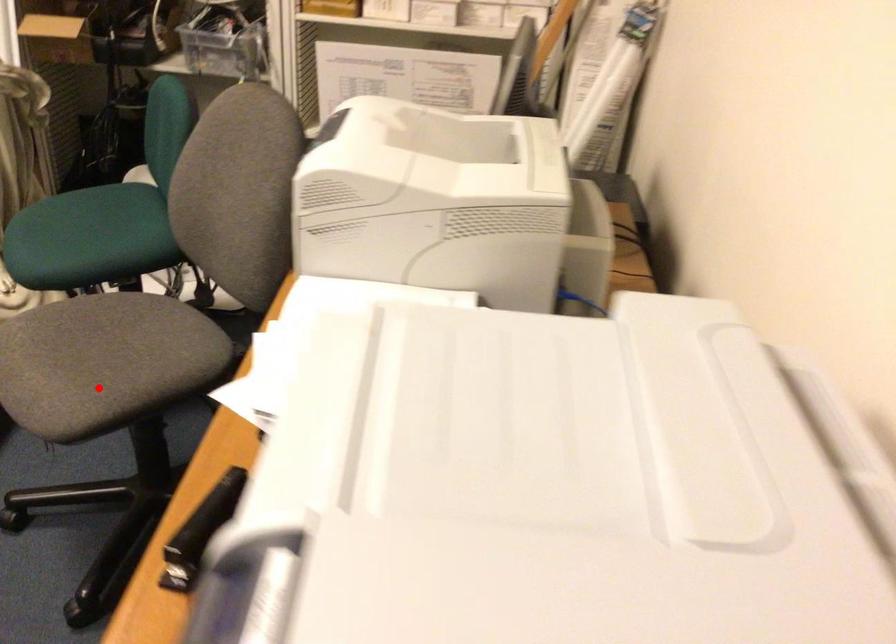
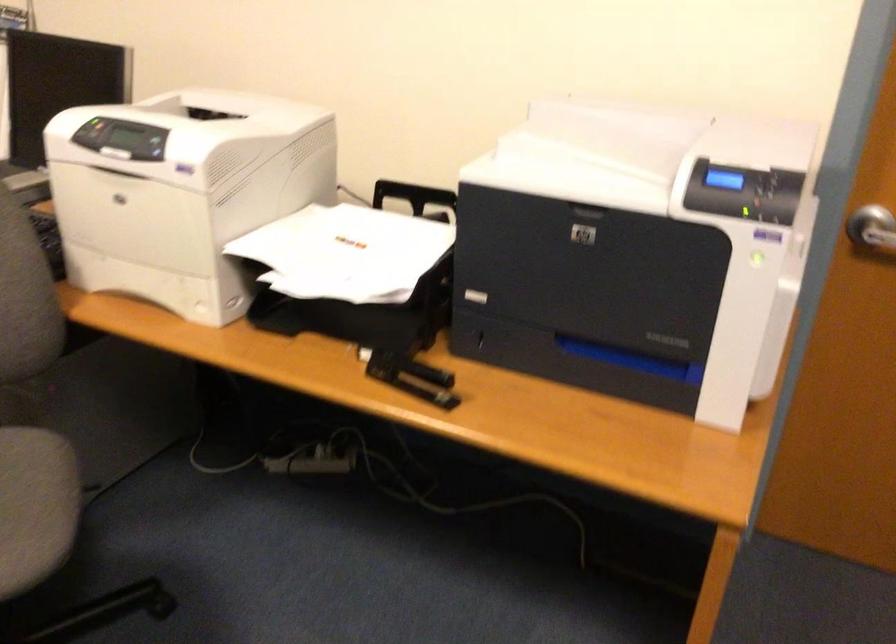
Question: A red point is marked in image1. In image2, is the corresponding 3D point closer to the camera or farther? Reply with the corresponding letter.

Choices:
 (A) The corresponding 3D point is closer.
 (B) The corresponding 3D point is farther.

Answer: (A)